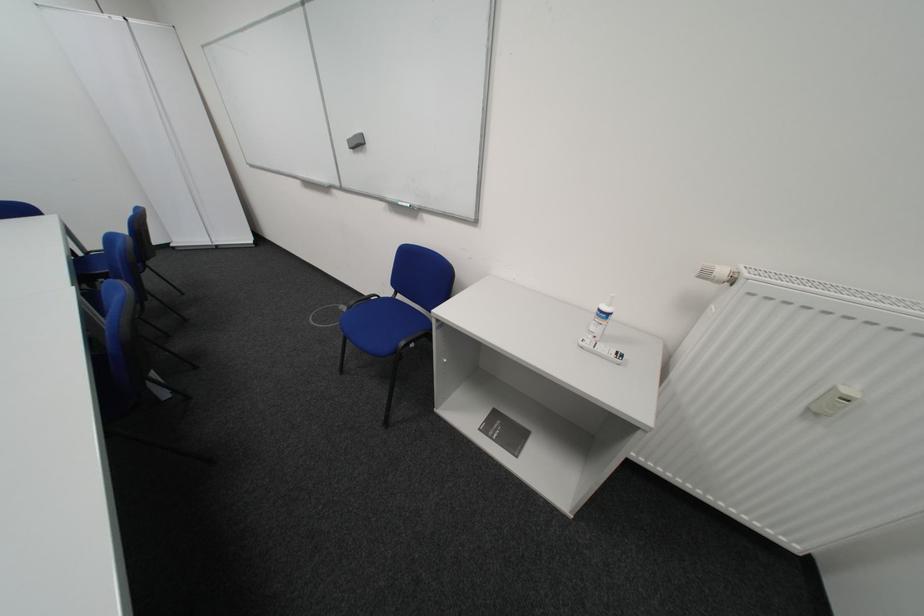
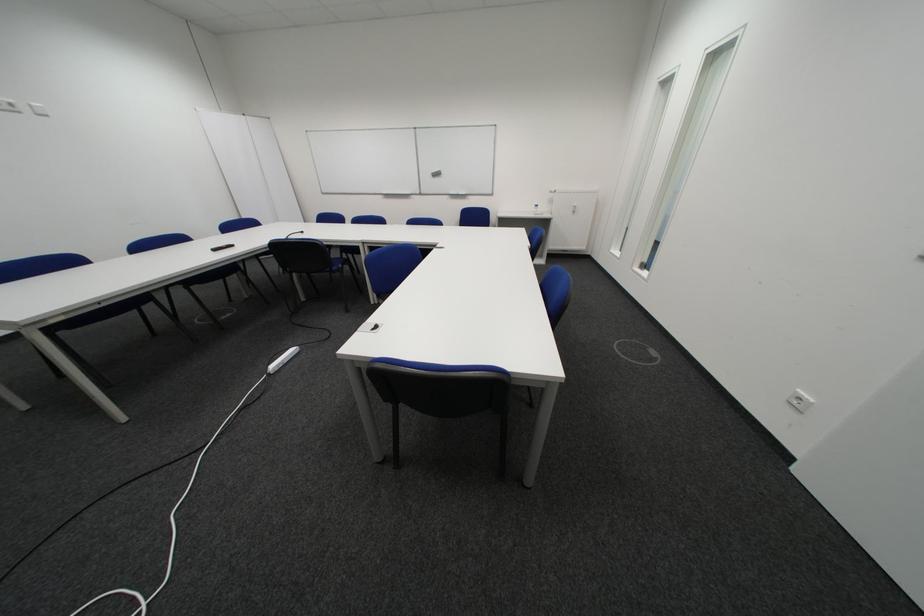
In a continuous first-person perspective shot, in which direction is the camera moving?

The cameraman moved toward left, backward.